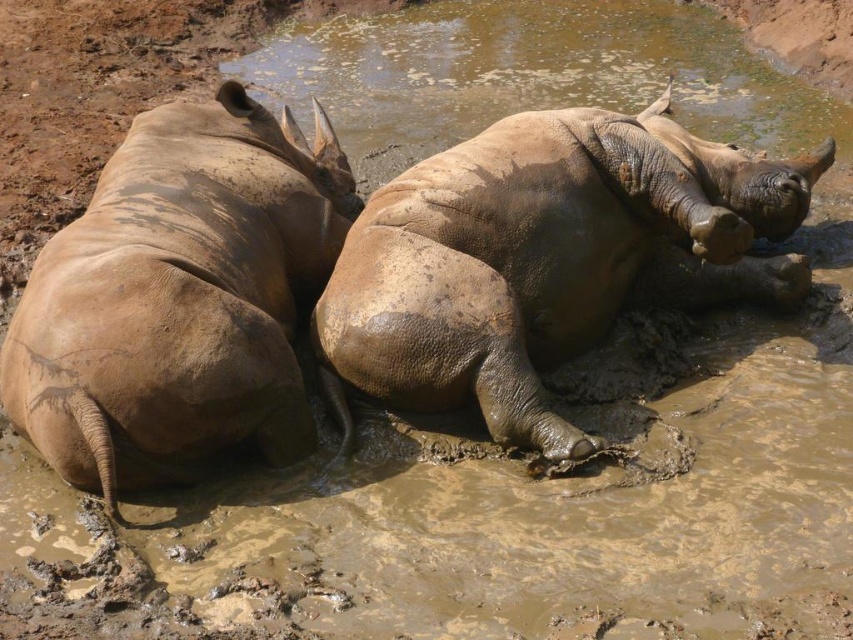
Is dull brown rhinoceros at center thinner than dull brown rhino at left?

Incorrect, dull brown rhinoceros at center's width is not less than dull brown rhino at left's.

Can you confirm if dull brown rhinoceros at center is shorter than dull brown rhino at left?

Correct, dull brown rhinoceros at center is not as tall as dull brown rhino at left.

The width and height of the screenshot is (853, 640). I want to click on dull brown rhinoceros at center, so click(546, 259).

Identify the location of dull brown rhinoceros at center. (546, 259).